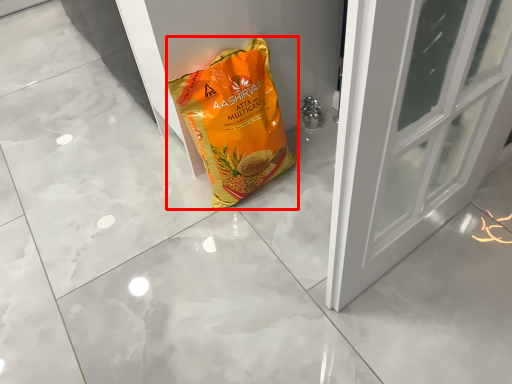
Question: Observing the image, what is the correct spatial positioning of plastic bag (annotated by the red box) in reference to door?

Choices:
 (A) right
 (B) left

Answer: (B)